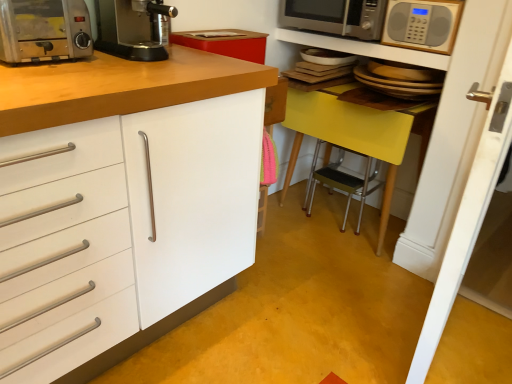
Question: Based on their positions, is black plastic coffee machine at upper center located to the left or right of metallic silver microwave at upper center?

Choices:
 (A) left
 (B) right

Answer: (A)

Question: From the image's perspective, is black plastic coffee machine at upper center positioned above or below metallic silver microwave at upper center?

Choices:
 (A) above
 (B) below

Answer: (B)

Question: Which is farther from the yellow plastic table at right?

Choices:
 (A) black plastic coffee machine at upper center
 (B) metallic silver toaster at upper left
 (C) metallic silver microwave at upper center
 (D) satin silver microwave at upper right, marked as the second microwave oven in a front-to-back arrangement
 (E) metallic silver step stool at center

Answer: (B)

Question: Which object is positioned farthest from the metallic silver step stool at center?

Choices:
 (A) silver metallic microwave at upper right, marked as the first microwave oven in a front-to-back arrangement
 (B) metallic silver toaster at upper left
 (C) yellow plastic table at right
 (D) satin silver microwave at upper right, which appears as the 1th microwave oven when viewed from the back
 (E) black plastic coffee machine at upper center

Answer: (B)